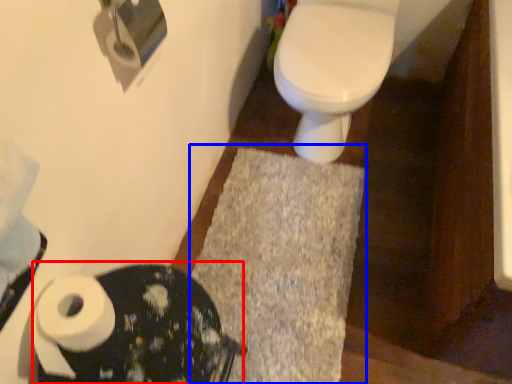
Question: Which of the following is the farthest to the observer, porcelain (highlighted by a red box) or bath mat (highlighted by a blue box)?

Choices:
 (A) porcelain
 (B) bath mat

Answer: (B)